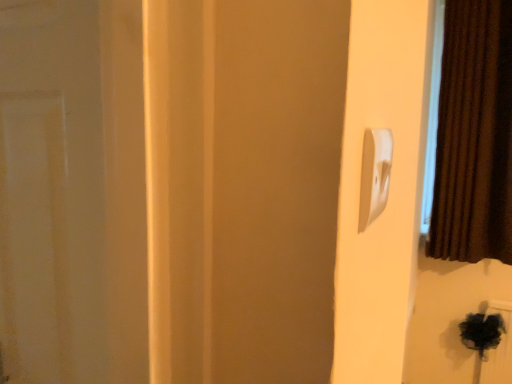
Question: From the image's perspective, is brown velvet curtain at right positioned above or below white plastic light switch at upper right?

Choices:
 (A) below
 (B) above

Answer: (B)

Question: In terms of width, does brown velvet curtain at right look wider or thinner when compared to white plastic light switch at upper right?

Choices:
 (A) wide
 (B) thin

Answer: (A)

Question: Does point (452, 223) appear closer or farther from the camera than point (366, 182)?

Choices:
 (A) closer
 (B) farther

Answer: (B)

Question: Would you say white plastic light switch at upper right is to the left or to the right of brown velvet curtain at right in the picture?

Choices:
 (A) left
 (B) right

Answer: (A)

Question: Looking at their shapes, would you say white plastic light switch at upper right is wider or thinner than brown velvet curtain at right?

Choices:
 (A) thin
 (B) wide

Answer: (A)

Question: From their relative heights in the image, would you say white plastic light switch at upper right is taller or shorter than brown velvet curtain at right?

Choices:
 (A) tall
 (B) short

Answer: (B)

Question: Looking at the image, does white plastic light switch at upper right seem bigger or smaller compared to brown velvet curtain at right?

Choices:
 (A) small
 (B) big

Answer: (A)